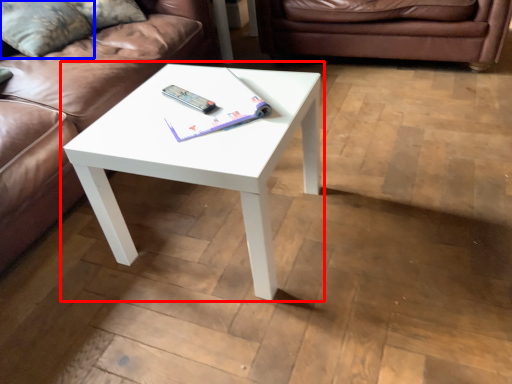
Question: Which of the following is the closest to the observer, coffee table (highlighted by a red box) or pillow (highlighted by a blue box)?

Choices:
 (A) coffee table
 (B) pillow

Answer: (A)